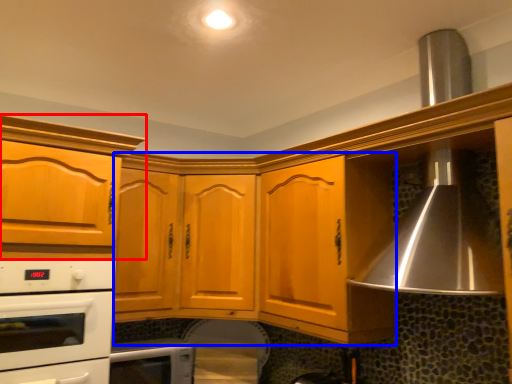
Question: Which of the following is the closest to the observer, cabinetry (highlighted by a red box) or cabinetry (highlighted by a blue box)?

Choices:
 (A) cabinetry
 (B) cabinetry

Answer: (A)